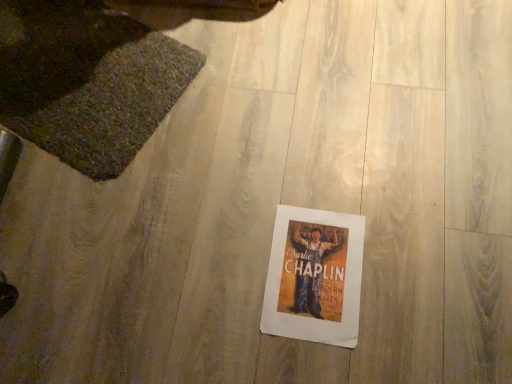
The image size is (512, 384). I want to click on blank space situated above white paper poster at center (from a real-world perspective), so click(x=315, y=270).